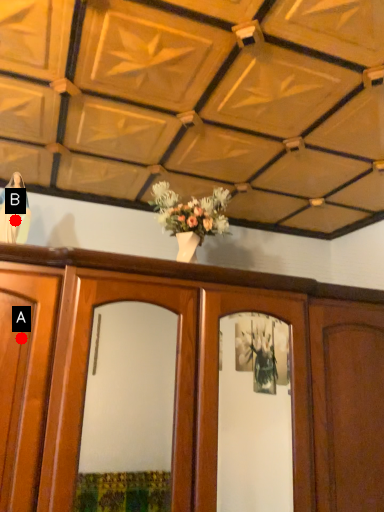
Question: Two points are circled on the image, labeled by A and B beside each circle. Which point appears closest to the camera in this image?

Choices:
 (A) A is closer
 (B) B is closer

Answer: (A)